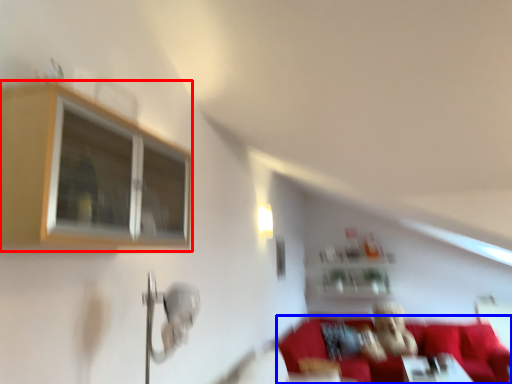
Question: Which of the following is the closest to the observer, window (highlighted by a red box) or couch (highlighted by a blue box)?

Choices:
 (A) window
 (B) couch

Answer: (A)